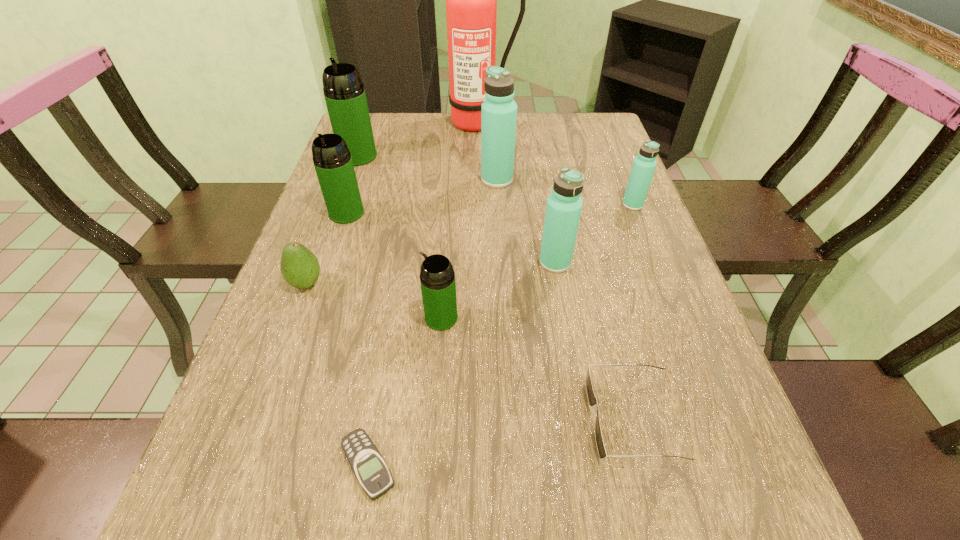
This screenshot has width=960, height=540. Identify the location of object that stands as the sixth closest to the red fire extinguisher. (300, 268).

Find the location of a particular element. The width and height of the screenshot is (960, 540). thermos bottle that is the third closest to the second biggest green thermos bottle is located at coordinates (437, 278).

At what (x,y) coordinates should I click in order to perform the action: click on thermos bottle that can be found as the fourth closest to the leftmost aqua thermos bottle. Please return your answer as a coordinate pair (x, y). This screenshot has height=540, width=960. Looking at the image, I should click on 344,92.

Where is `green thermos bottle that is the second closest to the second farthest green thermos bottle`? green thermos bottle that is the second closest to the second farthest green thermos bottle is located at coordinates (437, 278).

Identify which green thermos bottle is located as the nearest to the sunglasses. Please provide its 2D coordinates. Your answer should be formatted as a tuple, i.e. [(x, y)], where the tuple contains the x and y coordinates of a point satisfying the conditions above.

[(437, 278)]

Find the location of a particular element. This screenshot has width=960, height=540. the third closest aqua thermos bottle relative to the farthest thermos bottle is located at coordinates [644, 165].

In order to click on the third closest aqua thermos bottle to the third shortest object in this screenshot , I will do `click(644, 165)`.

This screenshot has width=960, height=540. Identify the location of free space that satisfies the following two spatial constraints: 1. on the front side of the rightmost thermos bottle; 2. from the spout of the third nearest object. (678, 318).

This screenshot has height=540, width=960. What are the coordinates of `free spot that satisfies the following two spatial constraints: 1. on the back side of the third farthest object; 2. on the left side of the avocado` in the screenshot? It's located at (346, 179).

Locate an element on the screen. This screenshot has width=960, height=540. free space that satisfies the following two spatial constraints: 1. from the spout of the second biggest green thermos bottle; 2. on the right side of the fifth thermos bottle from left to right is located at coordinates point(330,262).